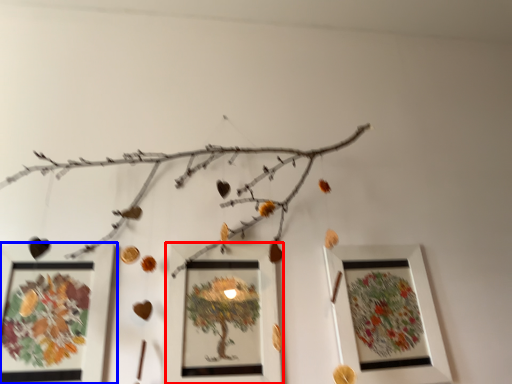
Question: Which of the following is the farthest to the observer, picture frame (highlighted by a red box) or picture frame (highlighted by a blue box)?

Choices:
 (A) picture frame
 (B) picture frame

Answer: (A)